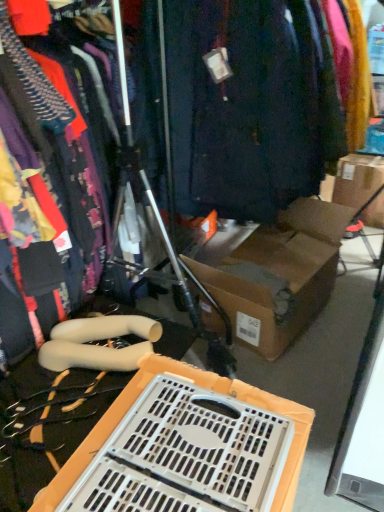
Question: Does dark blue fabric at center have a greater height compared to matte black dress at left?

Choices:
 (A) yes
 (B) no

Answer: (A)

Question: From a real-world perspective, is dark blue fabric at center physically above matte black dress at left?

Choices:
 (A) yes
 (B) no

Answer: (B)

Question: Is dark blue fabric at center facing towards matte black dress at left?

Choices:
 (A) no
 (B) yes

Answer: (A)

Question: Is dark blue fabric at center wider than matte black dress at left?

Choices:
 (A) no
 (B) yes

Answer: (B)

Question: Does dark blue fabric at center appear on the right side of matte black dress at left?

Choices:
 (A) yes
 (B) no

Answer: (A)

Question: In the image, is matte black dress at left positioned in front of or behind brown cardboard box at upper right?

Choices:
 (A) behind
 (B) front

Answer: (B)

Question: From the image's perspective, is matte black dress at left located above or below brown cardboard box at upper right?

Choices:
 (A) above
 (B) below

Answer: (B)

Question: From a real-world perspective, is matte black dress at left above or below brown cardboard box at upper right?

Choices:
 (A) below
 (B) above

Answer: (B)

Question: Is point (72, 106) closer or farther from the camera than point (350, 195)?

Choices:
 (A) closer
 (B) farther

Answer: (A)

Question: Is brown cardboard box at upper right spatially inside dark blue fabric at center, or outside of it?

Choices:
 (A) outside
 (B) inside

Answer: (A)

Question: In terms of height, does brown cardboard box at upper right look taller or shorter compared to dark blue fabric at center?

Choices:
 (A) tall
 (B) short

Answer: (B)

Question: Considering the relative positions of brown cardboard box at upper right and dark blue fabric at center in the image provided, is brown cardboard box at upper right to the left or to the right of dark blue fabric at center?

Choices:
 (A) left
 (B) right

Answer: (B)

Question: In terms of width, does brown cardboard box at upper right look wider or thinner when compared to dark blue fabric at center?

Choices:
 (A) wide
 (B) thin

Answer: (A)

Question: Considering the positions of brown cardboard box at upper right and white plastic crate at lower center in the image, is brown cardboard box at upper right taller or shorter than white plastic crate at lower center?

Choices:
 (A) short
 (B) tall

Answer: (B)

Question: Is brown cardboard box at upper right spatially inside white plastic crate at lower center, or outside of it?

Choices:
 (A) outside
 (B) inside

Answer: (A)